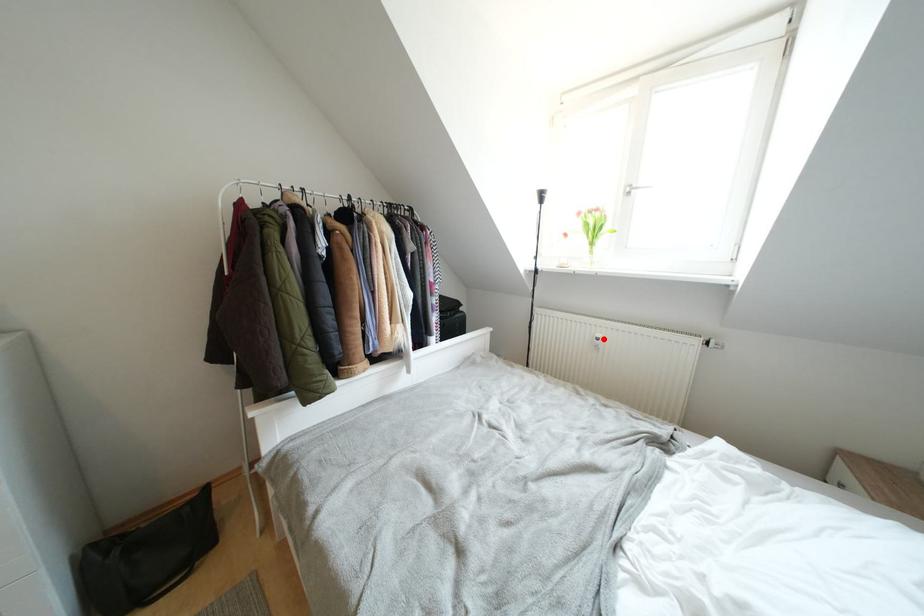
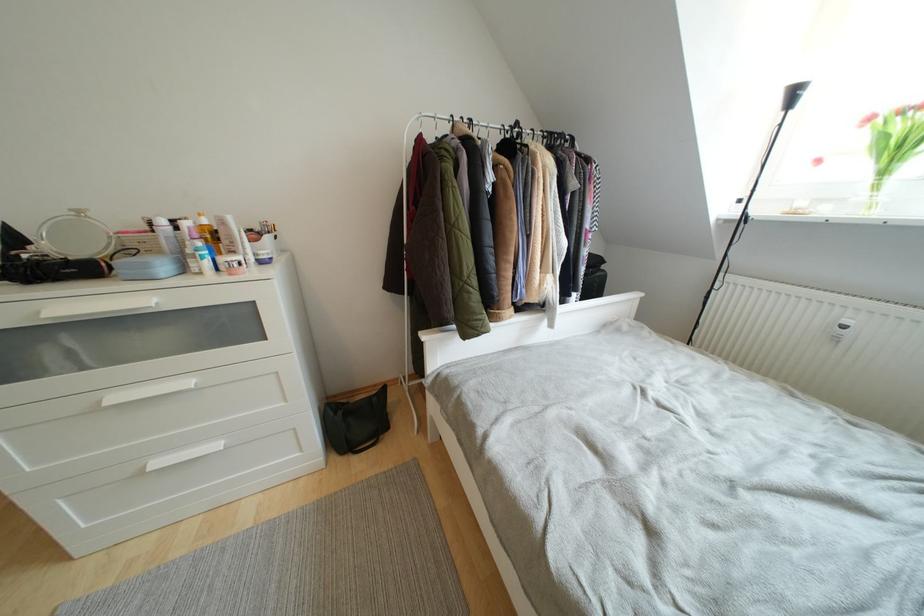
Locate, in the second image, the point that corresponds to the highlighted location in the first image.

(853, 326)